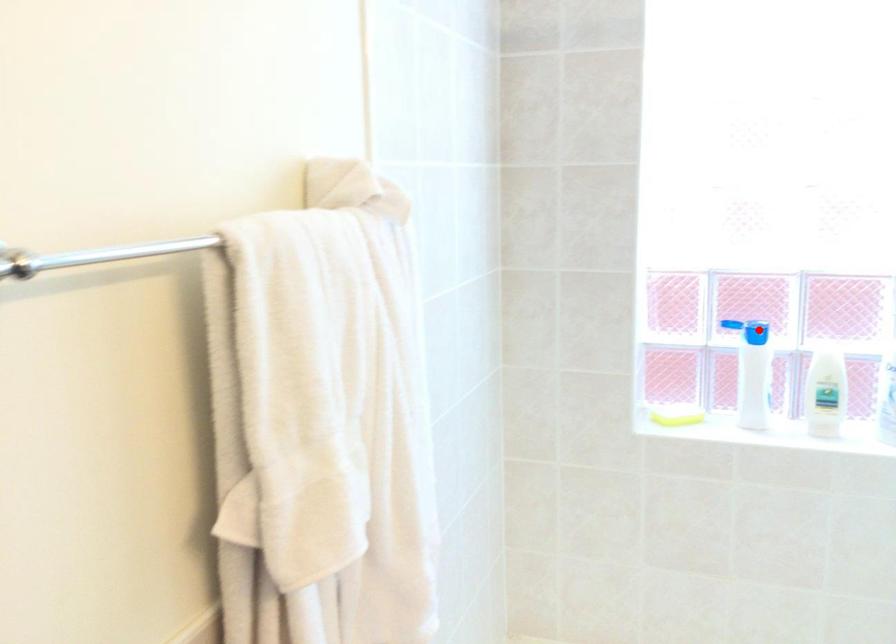
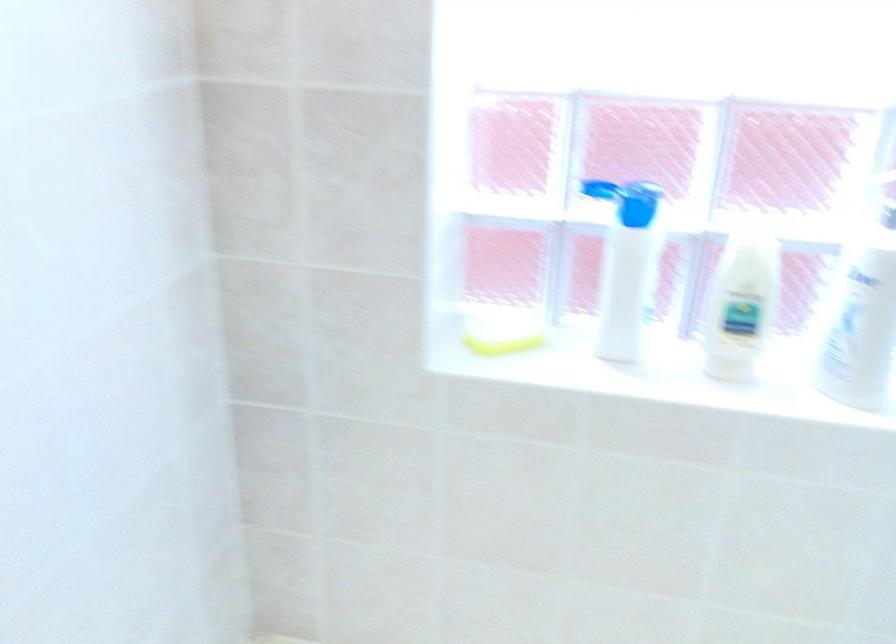
Where in the second image is the point corresponding to the highlighted location from the first image?

(636, 203)